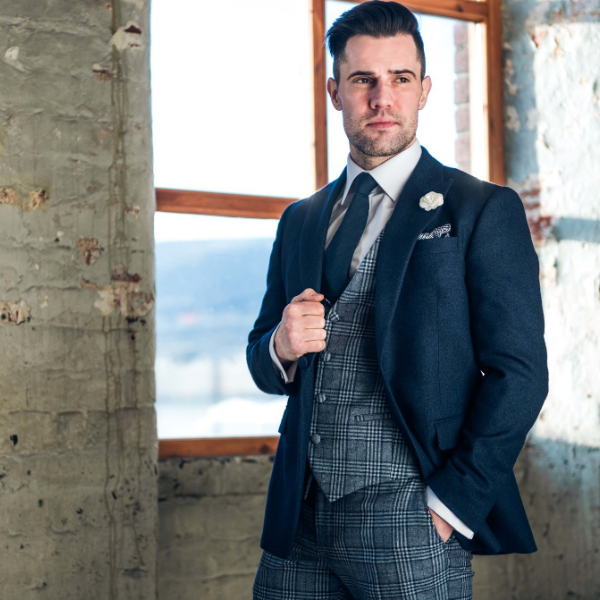
At what (x,y) coordinates should I click in order to perform the action: click on wall. Please return your answer as a coordinate pair (x, y). The image size is (600, 600). Looking at the image, I should click on (x=8, y=182).